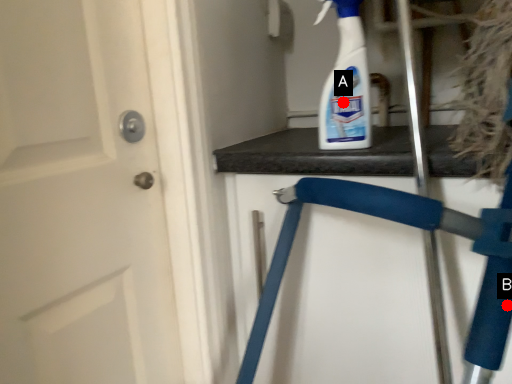
Question: Two points are circled on the image, labeled by A and B beside each circle. Which point is further to the camera?

Choices:
 (A) A is further
 (B) B is further

Answer: (A)